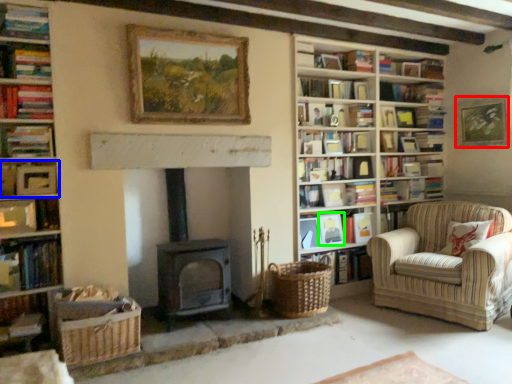
Question: Which is nearer to the picture frame (highlighted by a red box)? book (highlighted by a blue box) or picture frame (highlighted by a green box).

Choices:
 (A) book
 (B) picture frame

Answer: (B)